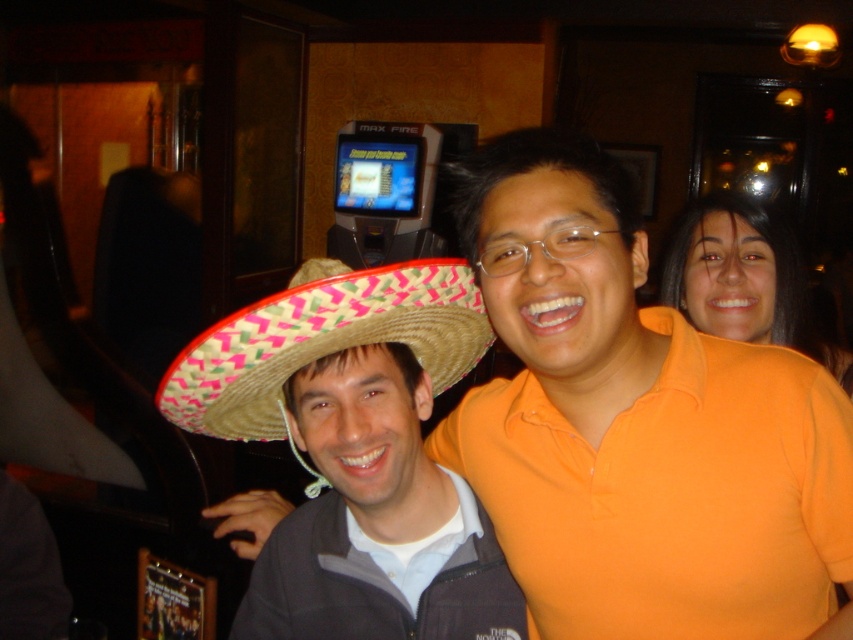
Question: Considering the relative positions of straw hat at center and bright pink woven straw sombrero at center in the image provided, where is straw hat at center located with respect to bright pink woven straw sombrero at center?

Choices:
 (A) below
 (B) above

Answer: (A)

Question: Which object is positioned farthest from the orange matte shirt at upper right?

Choices:
 (A) bright pink woven straw sombrero at center
 (B) straw hat at center

Answer: (B)

Question: Among these points, which one is farthest from the camera?

Choices:
 (A) tap(703, 228)
 (B) tap(347, 326)

Answer: (A)

Question: Based on their relative distances, which object is farther from the orange matte shirt at upper right?

Choices:
 (A) bright pink woven straw sombrero at center
 (B) straw hat at center

Answer: (B)

Question: Is bright pink woven straw sombrero at center thinner than orange matte shirt at upper right?

Choices:
 (A) no
 (B) yes

Answer: (A)

Question: Can you confirm if straw hat at center is smaller than orange matte shirt at upper right?

Choices:
 (A) no
 (B) yes

Answer: (A)